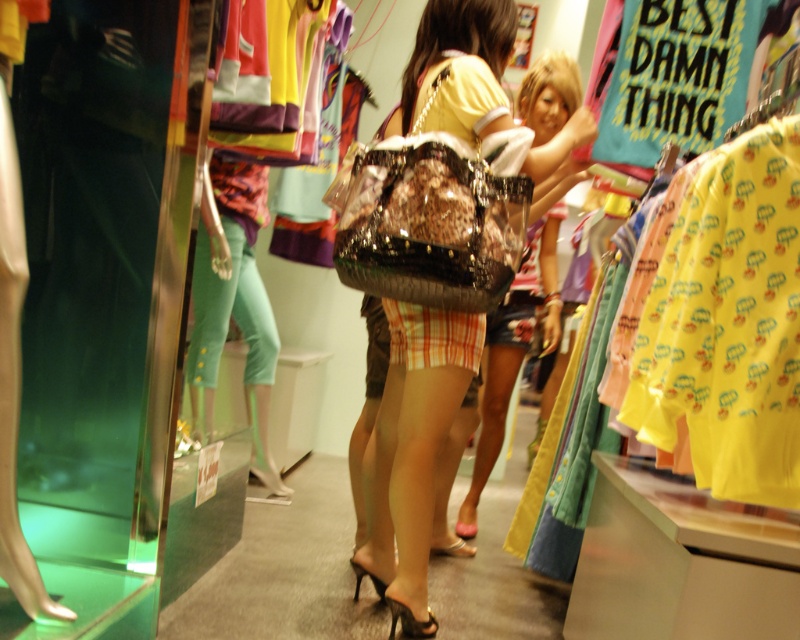
Question: Which point is farther to the camera?

Choices:
 (A) (430, 636)
 (B) (550, 250)
 (C) (360, 580)
 (D) (386, 534)

Answer: (B)

Question: Which of these objects is positioned farthest from the black patent leather high-heeled sandal at lower center?

Choices:
 (A) plaid fabric skirt at center
 (B) shiny black high-heeled sandal at center
 (C) shiny gold sandal at lower center
 (D) shiny pink sandal at lower center

Answer: (A)

Question: Which point is farther to the camera?

Choices:
 (A) shiny black high-heeled sandal at center
 (B) plaid fabric skirt at center
 (C) translucent plastic bag at center
 (D) shiny pink sandal at lower center

Answer: (D)

Question: Can you confirm if yellow printed fabric at right is smaller than plaid fabric skirt at center?

Choices:
 (A) no
 (B) yes

Answer: (B)

Question: Is translucent plastic bag at center smaller than shiny pink sandal at lower center?

Choices:
 (A) yes
 (B) no

Answer: (B)

Question: Does shiny gold sandal at lower center have a lesser width compared to shiny pink sandal at lower center?

Choices:
 (A) no
 (B) yes

Answer: (A)